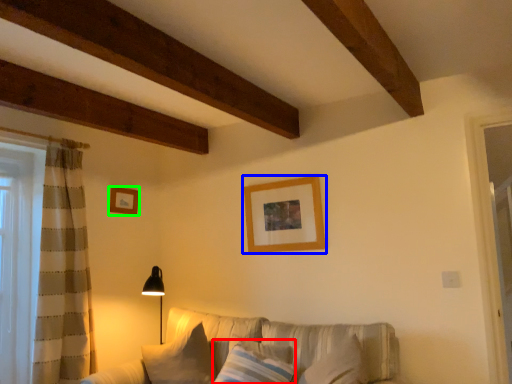
Question: Based on their relative distances, which object is farther from pillow (highlighted by a red box)? Choose from picture frame (highlighted by a blue box) and picture frame (highlighted by a green box).

Choices:
 (A) picture frame
 (B) picture frame

Answer: (B)